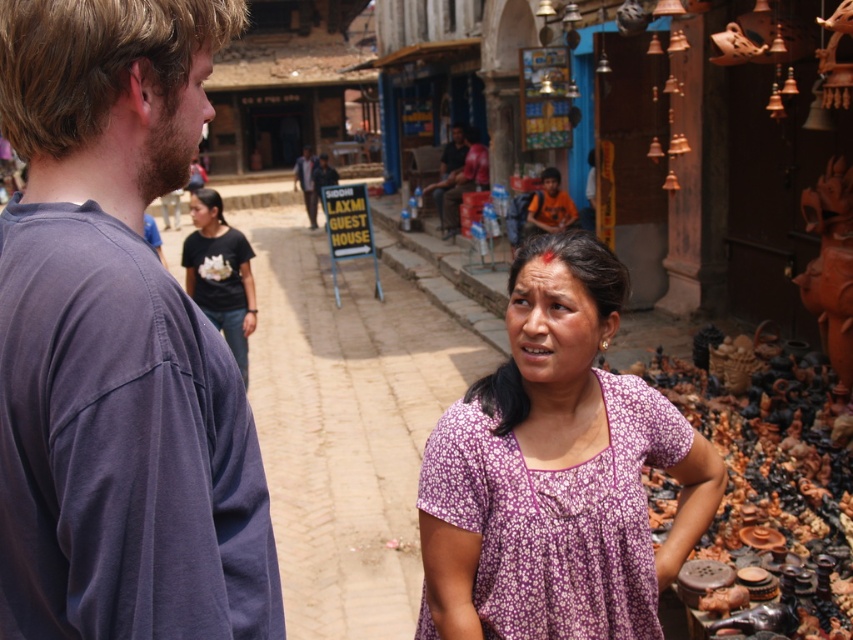
Between purple floral dress at center and matte black signboard at center, which one has less height?

purple floral dress at center

Does point (614, 317) lie behind point (316, 163)?

That is False.

Find the location of `purple floral dress at center`. purple floral dress at center is located at coordinates (555, 472).

Locate an element on the screen. purple floral dress at center is located at coordinates (555, 472).

Can you confirm if dark blue t-shirt at left is smaller than matte black signboard at center?

Yes, dark blue t-shirt at left is smaller than matte black signboard at center.

Is dark blue t-shirt at left wider than matte black signboard at center?

Incorrect, dark blue t-shirt at left's width does not surpass matte black signboard at center's.

You are a GUI agent. You are given a task and a screenshot of the screen. Output one action in this format:
    pyautogui.click(x=<x>, y=<y>)
    Task: Click on the dark blue t-shirt at left
    
    Given the screenshot: What is the action you would take?
    pyautogui.click(x=117, y=342)

Where is `dark blue t-shirt at left`? dark blue t-shirt at left is located at coordinates (117, 342).

Is dark blue t-shirt at left bigger than purple floral dress at center?

Incorrect, dark blue t-shirt at left is not larger than purple floral dress at center.

Does point (126, 397) come behind point (479, 509)?

No, (126, 397) is in front of (479, 509).

The image size is (853, 640). What do you see at coordinates (117, 342) in the screenshot?
I see `dark blue t-shirt at left` at bounding box center [117, 342].

What are the coordinates of `dark blue t-shirt at left` in the screenshot? It's located at (117, 342).